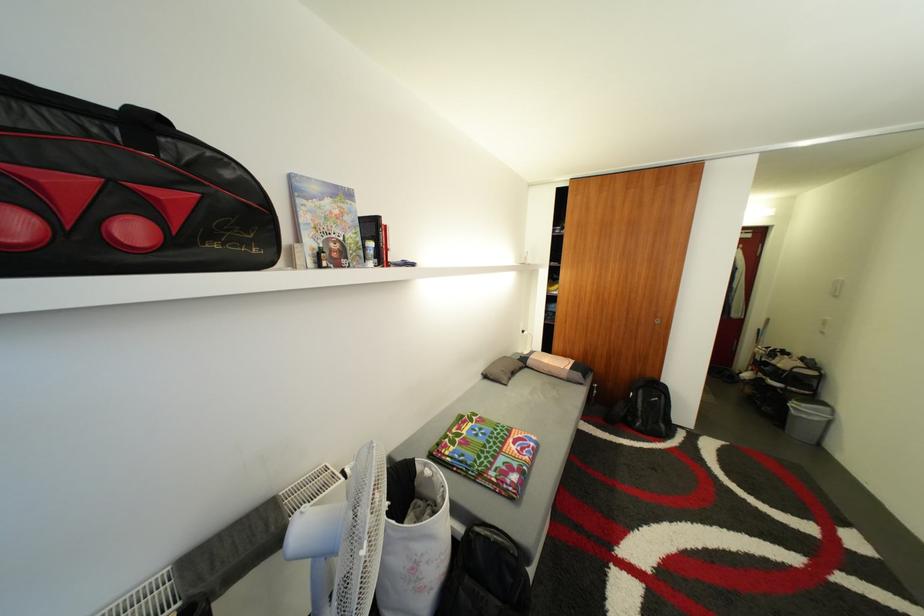
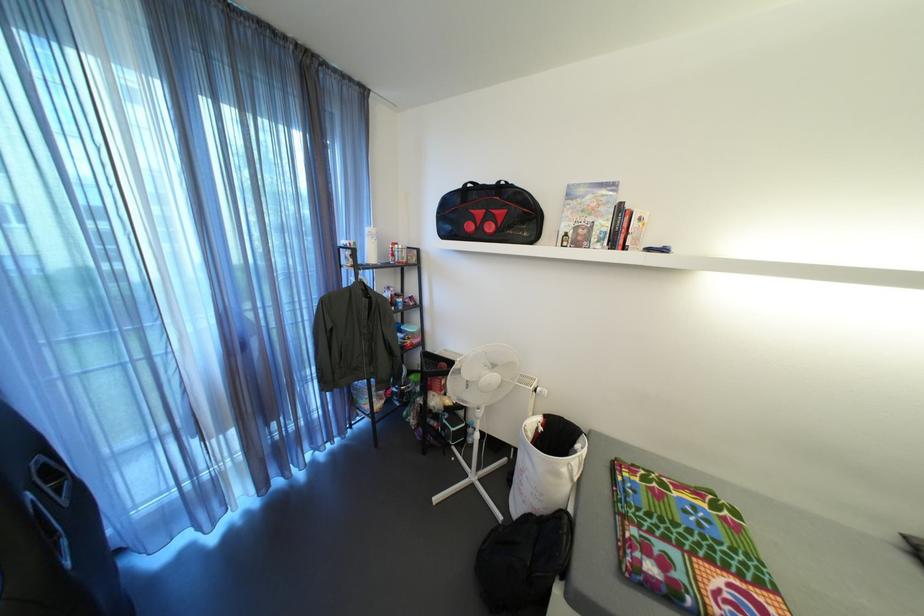
Question: The camera is either moving clockwise (left) or counter-clockwise (right) around the object. The first image is from the beginning of the video and the second image is from the end. Is the camera moving left or right when shooting the video?

Choices:
 (A) Left
 (B) Right

Answer: (B)